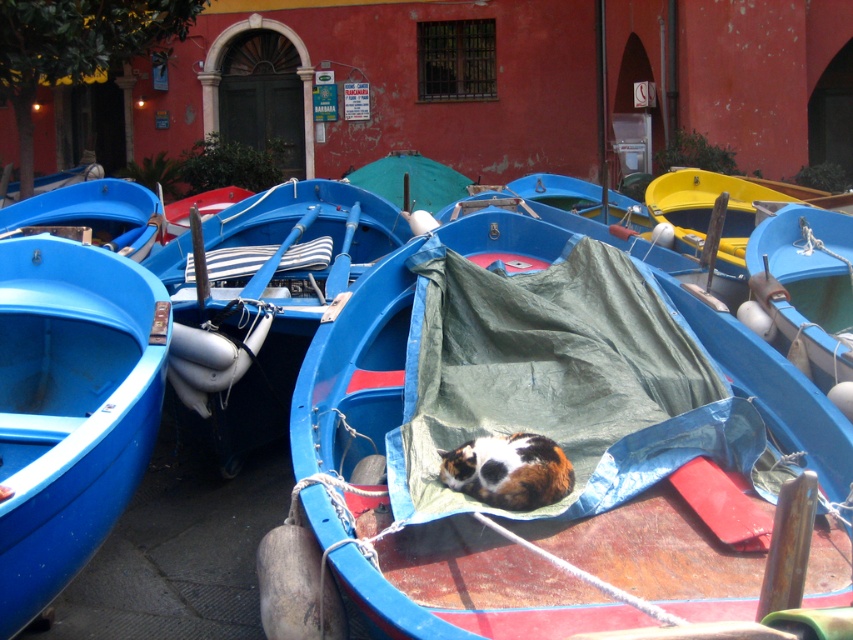
Where is `matte blue boat at center`? Image resolution: width=853 pixels, height=640 pixels. matte blue boat at center is located at coordinates (544, 429).

Can you confirm if matte blue boat at center is positioned above matte blue boat at left?

No, matte blue boat at center is not above matte blue boat at left.

Which is behind, point (672, 518) or point (65, 512)?

The point (672, 518) is behind.

Identify the location of matte blue boat at center. (544, 429).